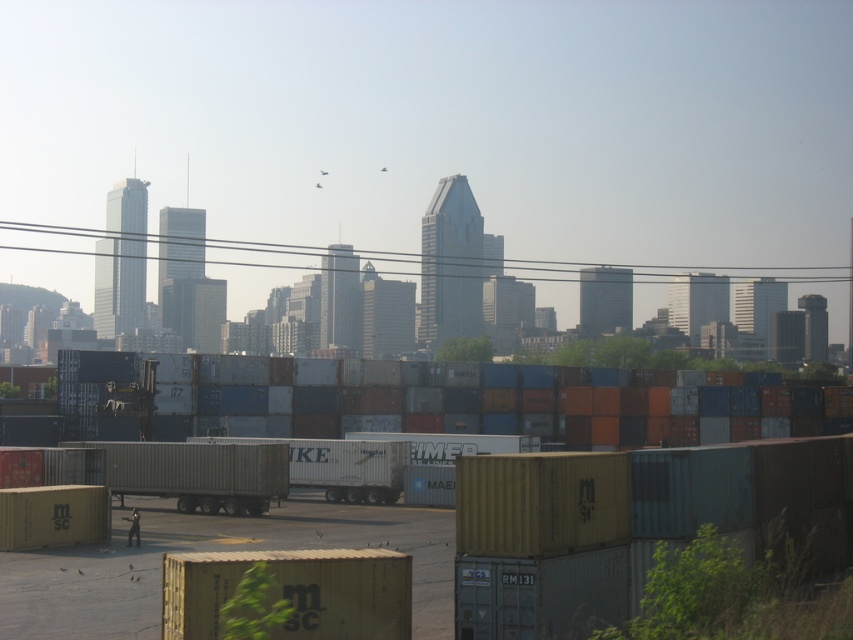
You are a delivery driver who needs to park your truck in a tight space between two other vehicles. You have to choose between the metallic silver trailer truck at center and the white matte trailer truck at center. Which truck should you choose to fit into the space?

You should choose the white matte trailer truck at center because it is smaller than the metallic silver trailer truck at center, making it more likely to fit into the tight space.

You are a delivery person trying to locate your assigned trailer truck in an industrial container yard. Your truck is the metallic silver trailer truck at center. From your current position, which direction should you move to avoid passing behind the white matte trailer truck at center?

The metallic silver trailer truck at center is in front of the white matte trailer truck at center, so you should move forward or to the sides to avoid going behind the white matte trailer truck at center.

In the scene shown: You are a delivery driver who needs to park your truck between the metallic silver trailer truck at center and the white matte trailer truck at center. The length of your truck is 16 feet. Can you safely park your truck in the space between them?

The distance between the metallic silver trailer truck at center and the white matte trailer truck at center is 17.46 feet. Since your truck is 16 feet long, there is enough space to park safely between them.